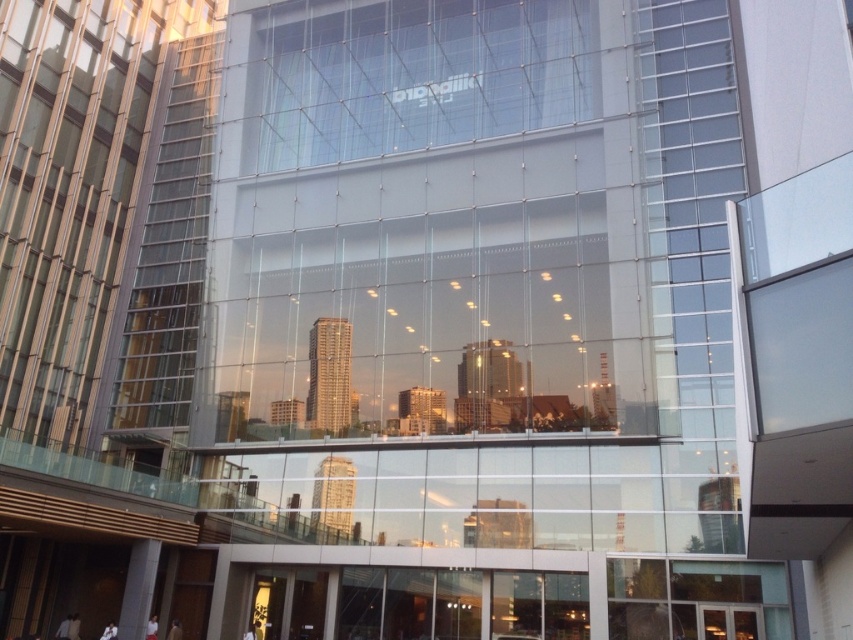
Question: Is transparent glass building at center above transparent glass window at center?

Choices:
 (A) yes
 (B) no

Answer: (B)

Question: Which point is farther to the camera?

Choices:
 (A) transparent glass window at center
 (B) transparent glass building at center

Answer: (A)

Question: Among these objects, which one is farthest from the camera?

Choices:
 (A) transparent glass building at center
 (B) transparent glass window at center

Answer: (B)

Question: Can you confirm if transparent glass building at center is thinner than transparent glass window at center?

Choices:
 (A) no
 (B) yes

Answer: (B)

Question: Does transparent glass building at center have a greater width compared to transparent glass window at center?

Choices:
 (A) yes
 (B) no

Answer: (B)